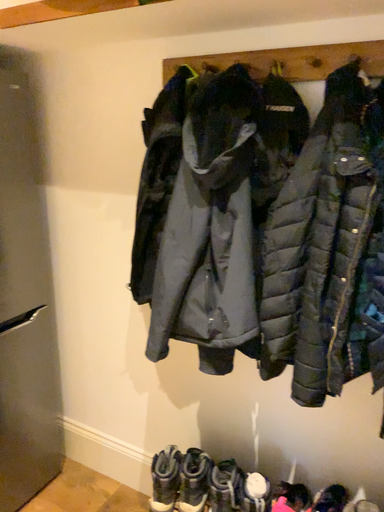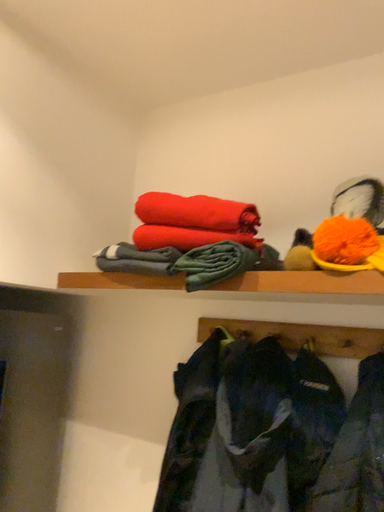
Question: How did the camera likely rotate when shooting the video?

Choices:
 (A) rotated downward
 (B) rotated upward

Answer: (B)